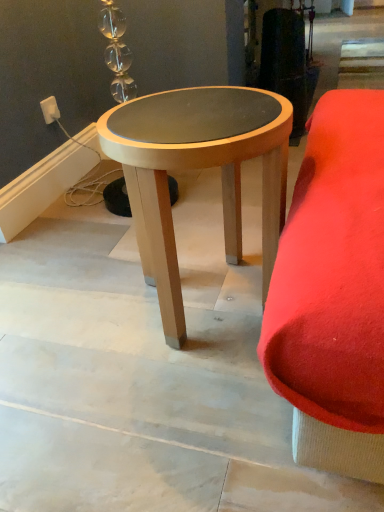
This screenshot has width=384, height=512. I want to click on vacant space underneath light wood/woodenobject at center (from a real-world perspective), so click(x=209, y=296).